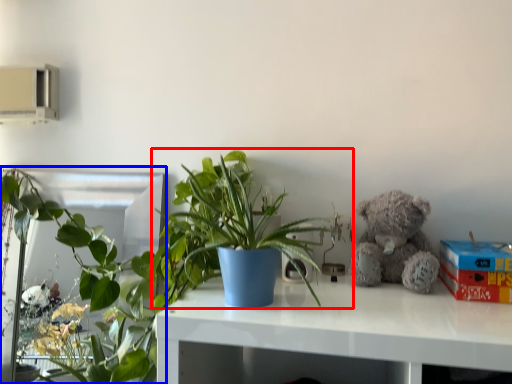
Question: Which object is closer to the camera taking this photo, houseplant (highlighted by a red box) or houseplant (highlighted by a blue box)?

Choices:
 (A) houseplant
 (B) houseplant

Answer: (A)